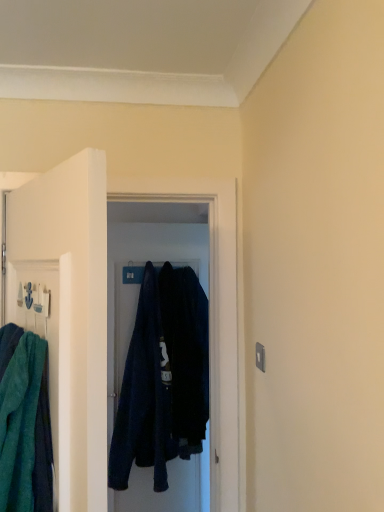
Question: In the image, is dark blue fabric at center positioned in front of or behind teal towel at left?

Choices:
 (A) front
 (B) behind

Answer: (B)

Question: Is point (155, 317) positioned closer to the camera than point (79, 203)?

Choices:
 (A) farther
 (B) closer

Answer: (A)

Question: Which is farther from the dark blue fabric at center?

Choices:
 (A) dark blue fabric robe at center
 (B) teal towel at left

Answer: (B)

Question: Estimate the real-world distances between objects in this image. Which object is farther from the dark blue fabric at center?

Choices:
 (A) teal towel at left
 (B) dark blue fabric robe at center

Answer: (A)